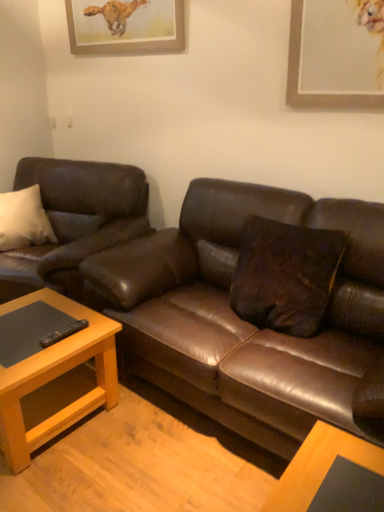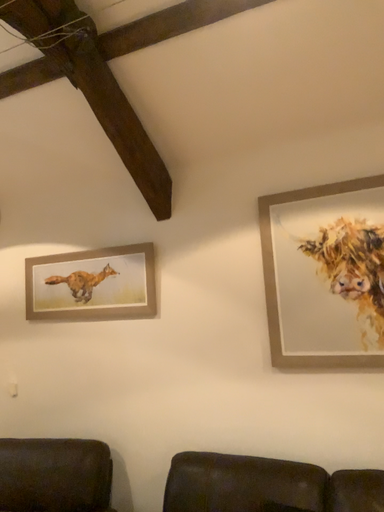
Question: How did the camera likely rotate when shooting the video?

Choices:
 (A) rotated right
 (B) rotated left

Answer: (A)